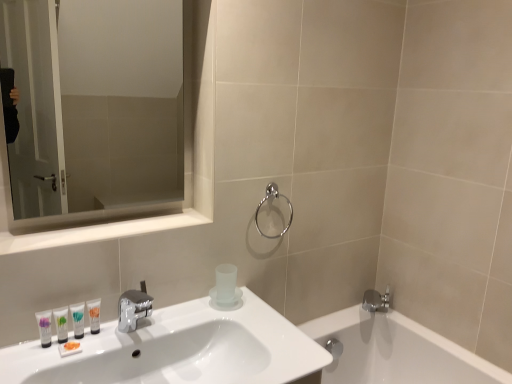
What is the approximate height of clear glass mirror at upper left?

26.62 inches.

Measure the distance between clear glass mirror at upper left and camera.

A distance of 7.79 feet exists between clear glass mirror at upper left and camera.

At what (x,y) coordinates should I click in order to perform the action: click on white glossy mirror at upper left. Please return your answer as a coordinate pair (x, y). Looking at the image, I should click on (99, 232).

What do you see at coordinates (99, 232) in the screenshot?
I see `white glossy mirror at upper left` at bounding box center [99, 232].

This screenshot has width=512, height=384. What do you see at coordinates (376, 301) in the screenshot?
I see `silver metallic faucet at lower right` at bounding box center [376, 301].

Image resolution: width=512 pixels, height=384 pixels. What do you see at coordinates (61, 323) in the screenshot?
I see `white glossy tube at lower left, which ranks as the second mouthwash in left-to-right order` at bounding box center [61, 323].

What do you see at coordinates (78, 319) in the screenshot?
I see `white glossy tube at lower left, the third mouthwash when ordered from left to right` at bounding box center [78, 319].

The height and width of the screenshot is (384, 512). I want to click on white glossy sink at lower left, so click(x=178, y=350).

Image resolution: width=512 pixels, height=384 pixels. What are the coordinates of `clear glass mirror at upper left` in the screenshot? It's located at (95, 103).

Consider the image. Can you tell me how much white glossy tube at lower left, which appears as the third mouthwash when viewed from the right, and white glossy mirror at upper left differ in facing direction?

4.41 degrees.

Does white glossy tube at lower left, which ranks as the second mouthwash in left-to-right order, come behind white glossy mirror at upper left?

Yes, white glossy tube at lower left, which ranks as the second mouthwash in left-to-right order, is further from the camera.

Between white glossy tube at lower left, which ranks as the second mouthwash in left-to-right order, and white glossy mirror at upper left, which one has larger size?

white glossy mirror at upper left is bigger.

Would you say white glossy tube at lower left, which ranks as the second mouthwash in left-to-right order, contains white glossy mirror at upper left?

No.

Between white glossy tube at lower left, which ranks as the second mouthwash in left-to-right order, and polished chrome towel ring at upper center, which one appears on the right side from the viewer's perspective?

polished chrome towel ring at upper center.

Where is `the 3rd mouthwash counting from the left of the polished chrome towel ring at upper center`? the 3rd mouthwash counting from the left of the polished chrome towel ring at upper center is located at coordinates (61, 323).

From a real-world perspective, is white glossy tube at lower left, which ranks as the second mouthwash in left-to-right order, physically located above or below polished chrome towel ring at upper center?

white glossy tube at lower left, which ranks as the second mouthwash in left-to-right order, is situated lower than polished chrome towel ring at upper center in the real world.

How many degrees apart are the facing directions of white glossy tube at lower left, which appears as the third mouthwash when viewed from the right, and polished chrome towel ring at upper center?

They differ by 4.74 degrees in their facing directions.

Is silver metallic faucet at lower right smaller than clear glass mirror at upper left?

Correct, silver metallic faucet at lower right occupies less space than clear glass mirror at upper left.

Can you confirm if silver metallic faucet at lower right is thinner than clear glass mirror at upper left?

Incorrect, the width of silver metallic faucet at lower right is not less than that of clear glass mirror at upper left.

Is silver metallic faucet at lower right facing away from clear glass mirror at upper left?

silver metallic faucet at lower right is not turned away from clear glass mirror at upper left.

Considering the sizes of objects silver metallic faucet at lower right and translucent plastic tube at sink, arranged as the fourth mouthwash when viewed from the left, in the image provided, who is taller, silver metallic faucet at lower right or translucent plastic tube at sink, arranged as the fourth mouthwash when viewed from the left,?

Standing taller between the two is silver metallic faucet at lower right.

Is silver metallic faucet at lower right situated inside translucent plastic tube at sink, the 1th mouthwash from the right, or outside?

silver metallic faucet at lower right is not inside translucent plastic tube at sink, the 1th mouthwash from the right, it's outside.

Consider the image. Is silver metallic faucet at lower right far away from translucent plastic tube at sink, arranged as the fourth mouthwash when viewed from the left?

That's right, there is a large distance between silver metallic faucet at lower right and translucent plastic tube at sink, arranged as the fourth mouthwash when viewed from the left.

Does silver metallic faucet at lower right have a greater width compared to translucent plastic tube at sink, the 1th mouthwash from the right?

Correct, the width of silver metallic faucet at lower right exceeds that of translucent plastic tube at sink, the 1th mouthwash from the right.

Can you confirm if translucent plastic tube at sink, arranged as the fourth mouthwash when viewed from the left, is smaller than white glossy tube at lower left, which ranks as the second mouthwash in left-to-right order?

Incorrect, translucent plastic tube at sink, arranged as the fourth mouthwash when viewed from the left, is not smaller in size than white glossy tube at lower left, which ranks as the second mouthwash in left-to-right order.

Is translucent plastic tube at sink, the 1th mouthwash from the right, outside of white glossy tube at lower left, which appears as the third mouthwash when viewed from the right?

Yes, translucent plastic tube at sink, the 1th mouthwash from the right, is not within white glossy tube at lower left, which appears as the third mouthwash when viewed from the right.

From a real-world perspective, which object rests below the other?

white glossy tube at lower left, which appears as the third mouthwash when viewed from the right, from a real-world perspective.

From the image's perspective, which one is positioned lower, clear glass mirror at upper left or white glossy mirror at upper left?

white glossy mirror at upper left appears lower in the image.

Is clear glass mirror at upper left oriented towards white glossy mirror at upper left?

Yes, clear glass mirror at upper left is turned towards white glossy mirror at upper left.

How many degrees apart are the facing directions of clear glass mirror at upper left and white glossy mirror at upper left?

clear glass mirror at upper left and white glossy mirror at upper left are facing 0.268 degrees away from each other.

From a real-world perspective, between clear glass mirror at upper left and white glossy mirror at upper left, who is vertically lower?

From a 3D spatial view, white glossy mirror at upper left is below.

Is the position of clear glass mirror at upper left more distant than that of matte white tube at lower left, marked as the fourth mouthwash in a right-to-left arrangement?

No, it is in front of matte white tube at lower left, marked as the fourth mouthwash in a right-to-left arrangement.

Considering the sizes of clear glass mirror at upper left and matte white tube at lower left, placed as the 1th mouthwash when sorted from left to right, in the image, is clear glass mirror at upper left wider or thinner than matte white tube at lower left, placed as the 1th mouthwash when sorted from left to right,?

Clearly, clear glass mirror at upper left has less width compared to matte white tube at lower left, placed as the 1th mouthwash when sorted from left to right.

Is matte white tube at lower left, placed as the 1th mouthwash when sorted from left to right, completely or partially inside clear glass mirror at upper left?

That's incorrect, matte white tube at lower left, placed as the 1th mouthwash when sorted from left to right, is not inside clear glass mirror at upper left.

How much distance is there between clear glass mirror at upper left and matte white tube at lower left, placed as the 1th mouthwash when sorted from left to right?

clear glass mirror at upper left is 2.21 meters away from matte white tube at lower left, placed as the 1th mouthwash when sorted from left to right.

This screenshot has height=384, width=512. I want to click on the 2nd mouthwash behind the white glossy mirror at upper left, so click(x=61, y=323).

The width and height of the screenshot is (512, 384). In order to click on mouthwash that is the 3rd object located in front of the polished chrome towel ring at upper center in this screenshot , I will do `click(61, 323)`.

From the picture: Estimate the real-world distances between objects in this image. Which object is further from white glossy tube at lower left, placed as the 2th mouthwash when sorted from right to left, polished chrome towel ring at upper center or white glossy mirror at upper left?

polished chrome towel ring at upper center is further to white glossy tube at lower left, placed as the 2th mouthwash when sorted from right to left.

Estimate the real-world distances between objects in this image. Which object is closer to white glossy tube at lower left, placed as the 2th mouthwash when sorted from right to left, white glossy mirror at upper left or white glossy tube at lower left, which appears as the third mouthwash when viewed from the right?

Among the two, white glossy tube at lower left, which appears as the third mouthwash when viewed from the right, is located nearer to white glossy tube at lower left, placed as the 2th mouthwash when sorted from right to left.

From the image, which object appears to be nearer to white glossy tube at lower left, placed as the 2th mouthwash when sorted from right to left, white glossy sink at lower left or translucent plastic tube at sink, the 1th mouthwash from the right?

Among the two, translucent plastic tube at sink, the 1th mouthwash from the right, is located nearer to white glossy tube at lower left, placed as the 2th mouthwash when sorted from right to left.

Estimate the real-world distances between objects in this image. Which object is closer to clear glass mirror at upper left, white glossy mirror at upper left or white glossy tube at lower left, the third mouthwash when ordered from left to right?

white glossy mirror at upper left.

When comparing their distances from matte white tube at lower left, placed as the 1th mouthwash when sorted from left to right, does white glossy mirror at upper left or white glossy tube at lower left, which appears as the third mouthwash when viewed from the right, seem further?

Among the two, white glossy mirror at upper left is located further to matte white tube at lower left, placed as the 1th mouthwash when sorted from left to right.

When comparing their distances from white glossy tube at lower left, placed as the 2th mouthwash when sorted from right to left, does silver metallic faucet at lower right or matte white tube at lower left, marked as the fourth mouthwash in a right-to-left arrangement, seem closer?

Based on the image, matte white tube at lower left, marked as the fourth mouthwash in a right-to-left arrangement, appears to be nearer to white glossy tube at lower left, placed as the 2th mouthwash when sorted from right to left.

When comparing their distances from translucent plastic tube at sink, arranged as the fourth mouthwash when viewed from the left, does white glossy tube at lower left, placed as the 2th mouthwash when sorted from right to left, or clear glass mirror at upper left seem closer?

Based on the image, white glossy tube at lower left, placed as the 2th mouthwash when sorted from right to left, appears to be nearer to translucent plastic tube at sink, arranged as the fourth mouthwash when viewed from the left.

From the picture: From the image, which object appears to be nearer to clear glass mirror at upper left, white glossy tube at lower left, which appears as the third mouthwash when viewed from the right, or white glossy sink at lower left?

Among the two, white glossy sink at lower left is located nearer to clear glass mirror at upper left.

At what (x,y) coordinates should I click in order to perform the action: click on balustrade located between white glossy sink at lower left and white glossy tube at lower left, placed as the 2th mouthwash when sorted from right to left, in the depth direction. Please return your answer as a coordinate pair (x, y). The image size is (512, 384). Looking at the image, I should click on (99, 232).

Locate an element on the screen. This screenshot has width=512, height=384. balustrade that lies between clear glass mirror at upper left and translucent plastic tube at sink, the 1th mouthwash from the right, from top to bottom is located at coordinates (99, 232).

Image resolution: width=512 pixels, height=384 pixels. I want to click on balustrade between white glossy sink at lower left and white glossy tube at lower left, which ranks as the second mouthwash in left-to-right order, in the front-back direction, so 99,232.

Where is `mirror between white glossy tube at lower left, which appears as the third mouthwash when viewed from the right, and silver metallic faucet at lower right from left to right`? mirror between white glossy tube at lower left, which appears as the third mouthwash when viewed from the right, and silver metallic faucet at lower right from left to right is located at coordinates (95, 103).